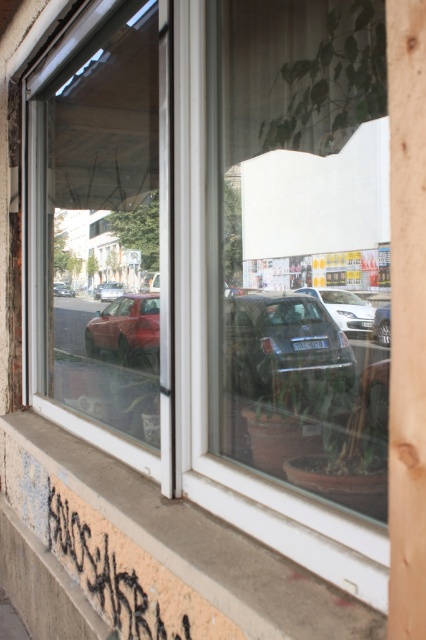
You are standing in front of a window and see the black graffiti at lower left and the matte red car at left reflected in it. Which object is positioned more to the left in the reflection?

The matte red car at left is positioned more to the left than the black graffiti at lower left because the black graffiti at lower left is to the right of the matte red car at left in the reflection.

You are standing 5 feet away from the window. If you want to look at the point marked at coordinates (129,608) on the window, will you be able to see it clearly?

The point marked at coordinates (129,608) is 5.22 feet away from the camera. Since you are standing 5 feet away from the window, you are close enough to see the point clearly.